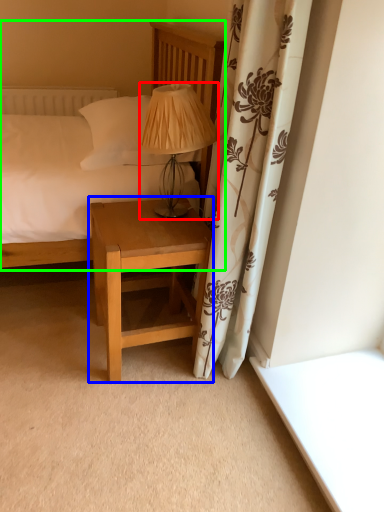
Question: Which object is positioned farthest from table lamp (highlighted by a red box)? Select from nightstand (highlighted by a blue box) and bed (highlighted by a green box).

Choices:
 (A) nightstand
 (B) bed

Answer: (A)